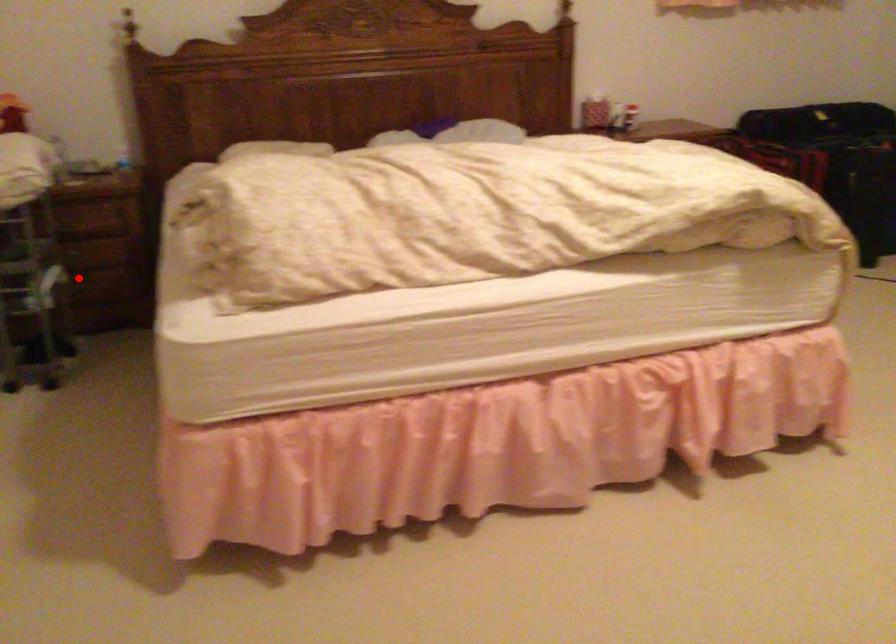
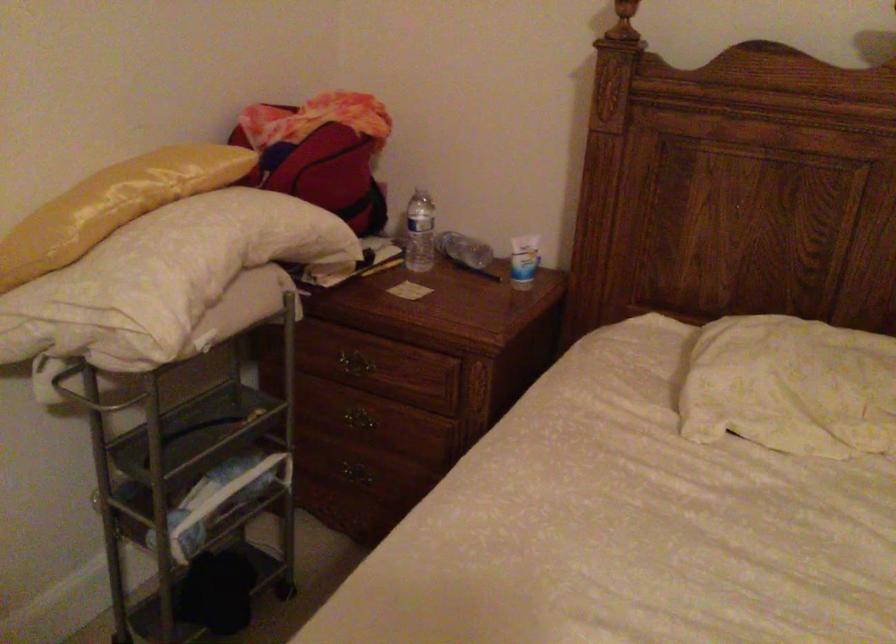
Question: I am providing you with two images of the same scene from different viewpoints. Image1 has a red point marked. In image2, the corresponding 3D location appears at what relative position? Reply with the corresponding letter.

Choices:
 (A) Closer
 (B) Farther

Answer: (A)